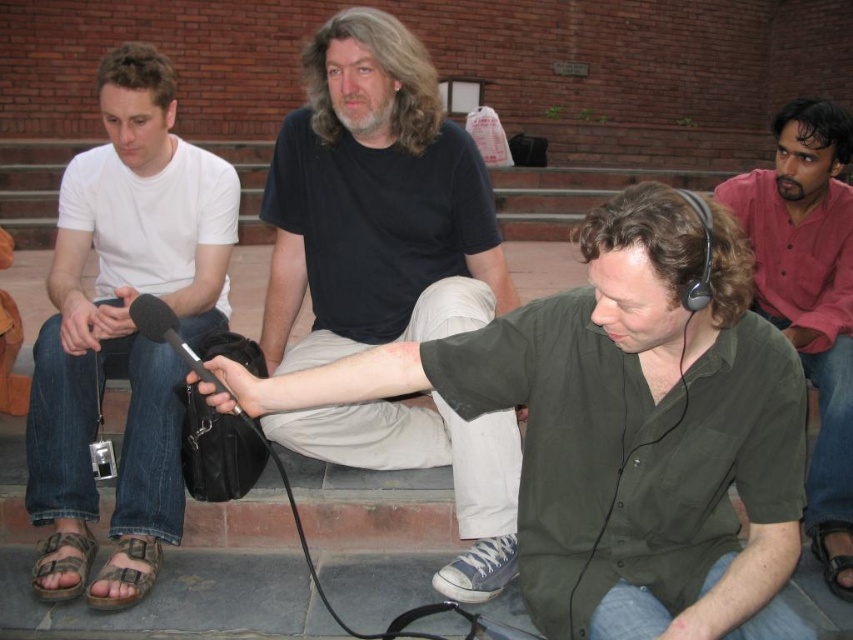
Which is more to the right, black matte shirt at center or black matte microphone at center?

Positioned to the right is black matte shirt at center.

What do you see at coordinates (375, 204) in the screenshot? Image resolution: width=853 pixels, height=640 pixels. I see `black matte shirt at center` at bounding box center [375, 204].

Does point (293, 225) come farther from viewer compared to point (155, 323)?

Yes, point (293, 225) is farther from viewer.

Find the location of `black matte shirt at center`. black matte shirt at center is located at coordinates (375, 204).

Consider the image. Who is more distant from viewer, (845, 323) or (141, 586)?

The point (845, 323) is more distant.

Locate an element on the screen. The height and width of the screenshot is (640, 853). green shirt at center is located at coordinates (808, 275).

Locate an element on the screen. This screenshot has width=853, height=640. green shirt at center is located at coordinates (808, 275).

What do you see at coordinates (62, 563) in the screenshot?
I see `brown canvas sandal at lower left` at bounding box center [62, 563].

Between brown canvas sandal at lower left and black matte microphone at center, which one appears on the right side from the viewer's perspective?

Positioned to the right is black matte microphone at center.

Measure the distance between brown canvas sandal at lower left and camera.

brown canvas sandal at lower left and camera are 2.43 meters apart.

At what (x,y) coordinates should I click in order to perform the action: click on brown canvas sandal at lower left. Please return your answer as a coordinate pair (x, y). Looking at the image, I should click on (62, 563).